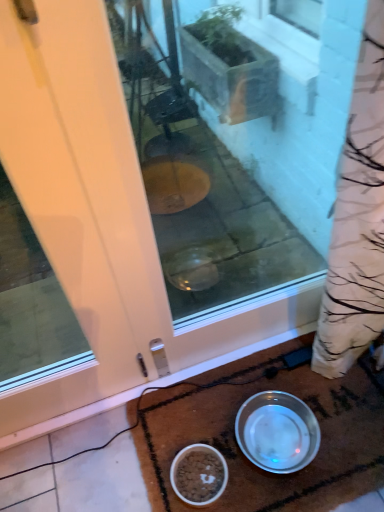
This screenshot has width=384, height=512. Identify the location of vacant space to the right of white glossy door at center. (151, 422).